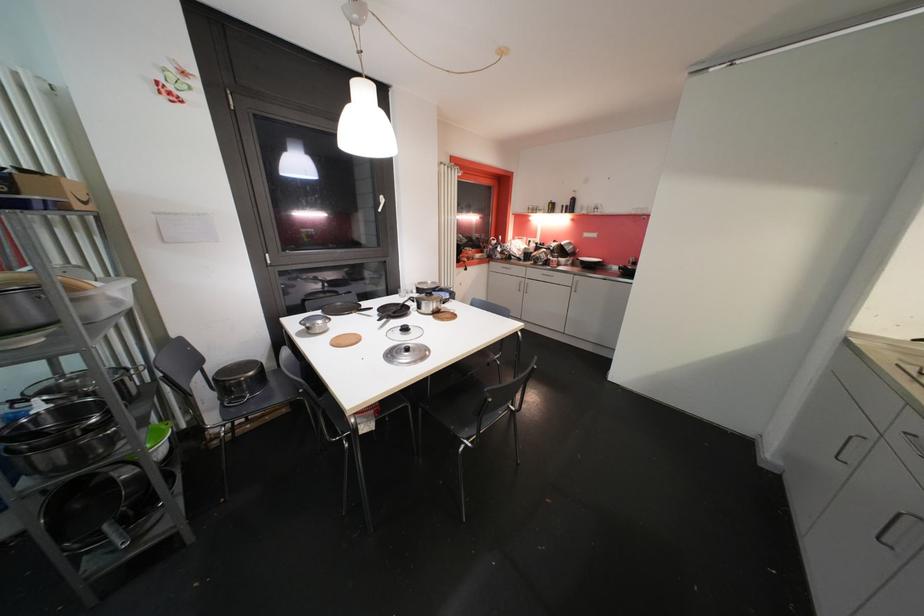
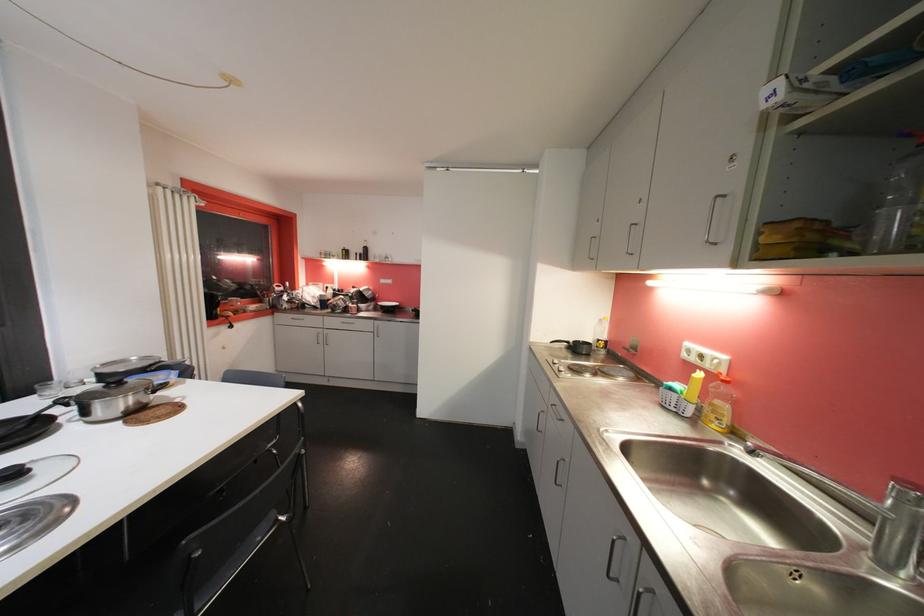
Question: The camera is either moving clockwise (left) or counter-clockwise (right) around the object. The first image is from the beginning of the video and the second image is from the end. Is the camera moving left or right when shooting the video?

Choices:
 (A) Left
 (B) Right

Answer: (A)